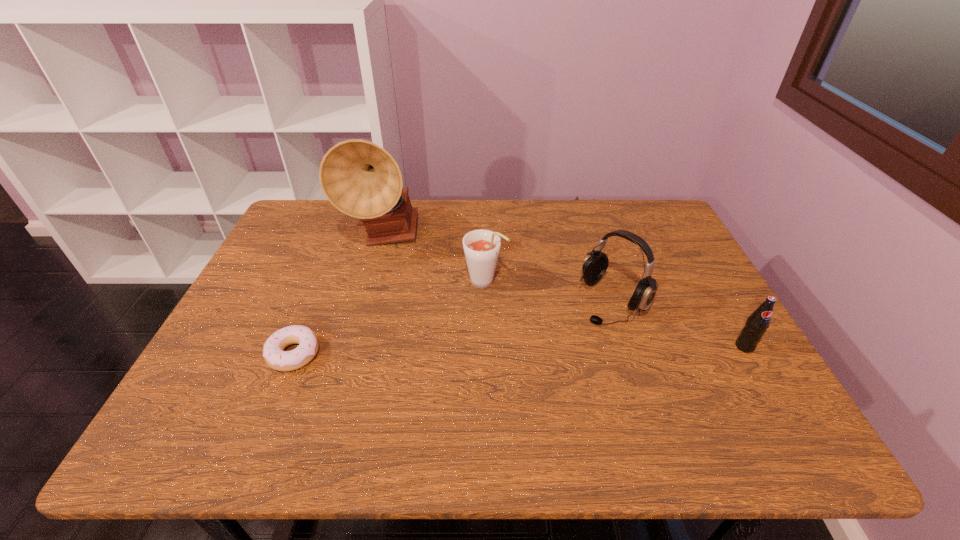
Locate an element on the screen. Image resolution: width=960 pixels, height=540 pixels. free spot that satisfies the following two spatial constraints: 1. on the front side of the third object from left to right; 2. on the left side of the headset is located at coordinates (486, 300).

At what (x,y) coordinates should I click in order to perform the action: click on free space that satisfies the following two spatial constraints: 1. on the front side of the phonograph record; 2. on the left side of the headset. Please return your answer as a coordinate pair (x, y). Looking at the image, I should click on (366, 300).

Where is `blank space that satisfies the following two spatial constraints: 1. on the back side of the root beer; 2. on the right side of the shortest object`? blank space that satisfies the following two spatial constraints: 1. on the back side of the root beer; 2. on the right side of the shortest object is located at coordinates (323, 281).